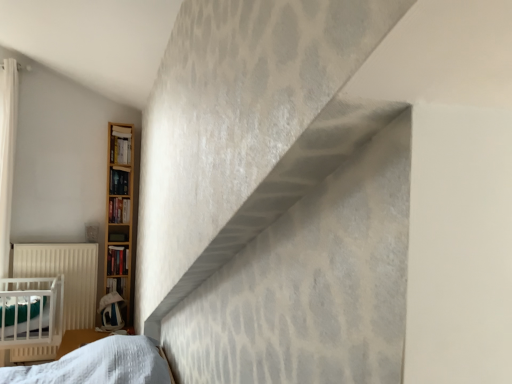
Image resolution: width=512 pixels, height=384 pixels. Find the location of `white textured sheet at lower left`. white textured sheet at lower left is located at coordinates (9, 315).

How much space does hardcover book at left, which appears as the fourth book when viewed from the top, occupy horizontally?

The width of hardcover book at left, which appears as the fourth book when viewed from the top, is 3.11 inches.

Measure the distance between point (64, 313) and camera.

Point (64, 313) and camera are 10.41 feet apart.

Describe the element at coordinates (120, 150) in the screenshot. The width and height of the screenshot is (512, 384). I see `wooden bookshelf at left, which appears as the first book when viewed from the top` at that location.

Describe the element at coordinates (118, 182) in the screenshot. I see `matte black bookshelf at left, the 2th book viewed from the top` at that location.

Identify the location of white textured sheet at lower left. (9, 315).

Can you confirm if wooden bookshelf at left, the fifth book when ordered from bottom to top, is thinner than hardcover book at left, which appears as the second book when ordered from the bottom?

No, wooden bookshelf at left, the fifth book when ordered from bottom to top, is not thinner than hardcover book at left, which appears as the second book when ordered from the bottom.

From the image's perspective, is wooden bookshelf at left, which appears as the first book when viewed from the top, on top of hardcover book at left, which appears as the second book when ordered from the bottom?

Yes, from the image's perspective, wooden bookshelf at left, which appears as the first book when viewed from the top, is over hardcover book at left, which appears as the second book when ordered from the bottom.

Find the location of a particular element. Image resolution: width=512 pixels, height=384 pixels. the 2nd book to the right of the hardcover book at left, which appears as the fourth book when viewed from the top, counting from the anchor's position is located at coordinates (120, 150).

Is wooden bookshelf at left, which appears as the first book when viewed from the top, to the left or to the right of hardcover book at left, which appears as the fourth book when viewed from the top, in the image?

Based on their positions, wooden bookshelf at left, which appears as the first book when viewed from the top, is located to the right of hardcover book at left, which appears as the fourth book when viewed from the top.

Based on the photo, is hardcover book at left, the 3th book from the top, wider than wooden bookshelf at left, the fifth book when ordered from bottom to top?

No, hardcover book at left, the 3th book from the top, is not wider than wooden bookshelf at left, the fifth book when ordered from bottom to top.

Which is correct: hardcover book at left, the 3th book from the top, is inside wooden bookshelf at left, which appears as the first book when viewed from the top, or outside of it?

hardcover book at left, the 3th book from the top, is outside wooden bookshelf at left, which appears as the first book when viewed from the top.

Which object is positioned more to the left, hardcover book at left, which ranks as the third book in bottom-to-top order, or wooden bookshelf at left, the fifth book when ordered from bottom to top?

hardcover book at left, which ranks as the third book in bottom-to-top order.

Is hardcover book at left, the 3th book from the top, looking in the opposite direction of wooden bookshelf at left, the fifth book when ordered from bottom to top?

That's not correct — hardcover book at left, the 3th book from the top, is not looking away from wooden bookshelf at left, the fifth book when ordered from bottom to top.

In the scene shown: Is matte black bookshelf at left, the 2th book viewed from the top, bigger than wooden bookshelf at left, which appears as the first book when viewed from the top?

Actually, matte black bookshelf at left, the 2th book viewed from the top, might be smaller than wooden bookshelf at left, which appears as the first book when viewed from the top.

Are matte black bookshelf at left, arranged as the 4th book when ordered from the bottom, and wooden bookshelf at left, which appears as the first book when viewed from the top, far apart?

No, matte black bookshelf at left, arranged as the 4th book when ordered from the bottom, is in close proximity to wooden bookshelf at left, which appears as the first book when viewed from the top.

From the picture: From the image's perspective, is matte black bookshelf at left, arranged as the 4th book when ordered from the bottom, positioned above or below wooden bookshelf at left, the fifth book when ordered from bottom to top?

matte black bookshelf at left, arranged as the 4th book when ordered from the bottom, is below wooden bookshelf at left, the fifth book when ordered from bottom to top.

The height and width of the screenshot is (384, 512). Identify the location of book lying above the matte black bookshelf at left, the 2th book viewed from the top (from the image's perspective). (120, 150).

Is point (118, 285) in front of point (114, 218)?

Yes.

Image resolution: width=512 pixels, height=384 pixels. Identify the location of book behind the hardcover book at left, positioned as the first book in bottom-to-top order. (119, 210).

Is hardcover book at left, which appears as the 5th book when viewed from the top, shorter than hardcover book at left, the 3th book from the top?

No, hardcover book at left, which appears as the 5th book when viewed from the top, is not shorter than hardcover book at left, the 3th book from the top.

Can you see hardcover book at left, which appears as the 5th book when viewed from the top, touching hardcover book at left, which ranks as the third book in bottom-to-top order?

No, hardcover book at left, which appears as the 5th book when viewed from the top, is not touching hardcover book at left, which ranks as the third book in bottom-to-top order.

From the image's perspective, which is above, white textured sheet at lower left or wooden bookshelf at left, which appears as the first book when viewed from the top?

wooden bookshelf at left, which appears as the first book when viewed from the top, from the image's perspective.

Between white textured sheet at lower left and wooden bookshelf at left, the fifth book when ordered from bottom to top, which one appears on the right side from the viewer's perspective?

From the viewer's perspective, wooden bookshelf at left, the fifth book when ordered from bottom to top, appears more on the right side.

Where is `the 4th book above the white textured sheet at lower left (from the image's perspective)`? the 4th book above the white textured sheet at lower left (from the image's perspective) is located at coordinates (120, 150).

From a real-world perspective, is white textured sheet at lower left on top of wooden bookshelf at left, the fifth book when ordered from bottom to top?

Actually, white textured sheet at lower left is physically below wooden bookshelf at left, the fifth book when ordered from bottom to top, in the real world.

In the scene shown: From the image's perspective, is white textured sheet at lower left on top of hardcover book at left, positioned as the first book in bottom-to-top order?

Yes, from the image's perspective, white textured sheet at lower left is on top of hardcover book at left, positioned as the first book in bottom-to-top order.

Does point (31, 313) come farther from viewer compared to point (115, 288)?

No, it is not.

This screenshot has width=512, height=384. What are the coordinates of `sheet above the hardcover book at left, which appears as the 5th book when viewed from the top (from the image's perspective)` in the screenshot? It's located at (9, 315).

Is white textured sheet at lower left at the left side of hardcover book at left, which appears as the fourth book when viewed from the top?

Indeed, white textured sheet at lower left is positioned on the left side of hardcover book at left, which appears as the fourth book when viewed from the top.

Is white textured sheet at lower left looking in the opposite direction of hardcover book at left, which appears as the second book when ordered from the bottom?

No, white textured sheet at lower left is not facing away from hardcover book at left, which appears as the second book when ordered from the bottom.

Which is in front, point (30, 313) or point (120, 263)?

The point (30, 313) is more forward.

From the image's perspective, which is below, white textured sheet at lower left or hardcover book at left, which appears as the second book when ordered from the bottom?

white textured sheet at lower left appears lower in the image.

Find the location of `the 3rd book below the wooden bookshelf at left, which appears as the first book when viewed from the top (from the image's perspective)`. the 3rd book below the wooden bookshelf at left, which appears as the first book when viewed from the top (from the image's perspective) is located at coordinates (117, 260).

I want to click on the 3rd book in front of the hardcover book at left, the 3th book from the top, counting from the anchor's position, so click(120, 150).

Looking at the image, which one is located closer to matte black bookshelf at left, arranged as the 4th book when ordered from the bottom, hardcover book at left, which appears as the second book when ordered from the bottom, or hardcover book at left, which ranks as the third book in bottom-to-top order?

hardcover book at left, which ranks as the third book in bottom-to-top order.

Considering their positions, is white textured sheet at lower left positioned closer to hardcover book at left, which appears as the 5th book when viewed from the top, than wooden bookshelf at left, the fifth book when ordered from bottom to top?

white textured sheet at lower left lies closer to hardcover book at left, which appears as the 5th book when viewed from the top, than the other object.

Estimate the real-world distances between objects in this image. Which object is further from white textured sheet at lower left, matte black bookshelf at left, the 2th book viewed from the top, or hardcover book at left, which appears as the 5th book when viewed from the top?

matte black bookshelf at left, the 2th book viewed from the top.

Estimate the real-world distances between objects in this image. Which object is closer to matte black bookshelf at left, the 2th book viewed from the top, white matte radiator at left or wooden bookshelf at left, the fifth book when ordered from bottom to top?

Based on the image, wooden bookshelf at left, the fifth book when ordered from bottom to top, appears to be nearer to matte black bookshelf at left, the 2th book viewed from the top.

Based on their spatial positions, is matte black bookshelf at left, arranged as the 4th book when ordered from the bottom, or white textured sheet at lower left further from wooden bookshelf at left, which appears as the first book when viewed from the top?

white textured sheet at lower left lies further to wooden bookshelf at left, which appears as the first book when viewed from the top, than the other object.

Considering their positions, is white textured sheet at lower left positioned further to matte black bookshelf at left, the 2th book viewed from the top, than white matte radiator at left?

white textured sheet at lower left is positioned further to the anchor matte black bookshelf at left, the 2th book viewed from the top.

When comparing their distances from white matte radiator at left, does hardcover book at left, which appears as the fourth book when viewed from the top, or hardcover book at left, positioned as the first book in bottom-to-top order, seem further?

hardcover book at left, positioned as the first book in bottom-to-top order, lies further to white matte radiator at left than the other object.

Estimate the real-world distances between objects in this image. Which object is closer to hardcover book at left, positioned as the first book in bottom-to-top order, hardcover book at left, which ranks as the third book in bottom-to-top order, or white matte radiator at left?

Based on the image, white matte radiator at left appears to be nearer to hardcover book at left, positioned as the first book in bottom-to-top order.

I want to click on book between hardcover book at left, the 3th book from the top, and hardcover book at left, positioned as the first book in bottom-to-top order, vertically, so click(x=117, y=260).

Find the location of `book between matte black bookshelf at left, arranged as the 4th book when ordered from the bottom, and hardcover book at left, which appears as the fourth book when viewed from the top, in the up-down direction`. book between matte black bookshelf at left, arranged as the 4th book when ordered from the bottom, and hardcover book at left, which appears as the fourth book when viewed from the top, in the up-down direction is located at coordinates (119, 210).

Where is `sheet between matte black bookshelf at left, the 2th book viewed from the top, and hardcover book at left, which appears as the 5th book when viewed from the top, from top to bottom`? The width and height of the screenshot is (512, 384). sheet between matte black bookshelf at left, the 2th book viewed from the top, and hardcover book at left, which appears as the 5th book when viewed from the top, from top to bottom is located at coordinates (9, 315).

Locate an element on the screen. The width and height of the screenshot is (512, 384). radiator between matte black bookshelf at left, arranged as the 4th book when ordered from the bottom, and hardcover book at left, which appears as the 5th book when viewed from the top, in the vertical direction is located at coordinates (64, 276).